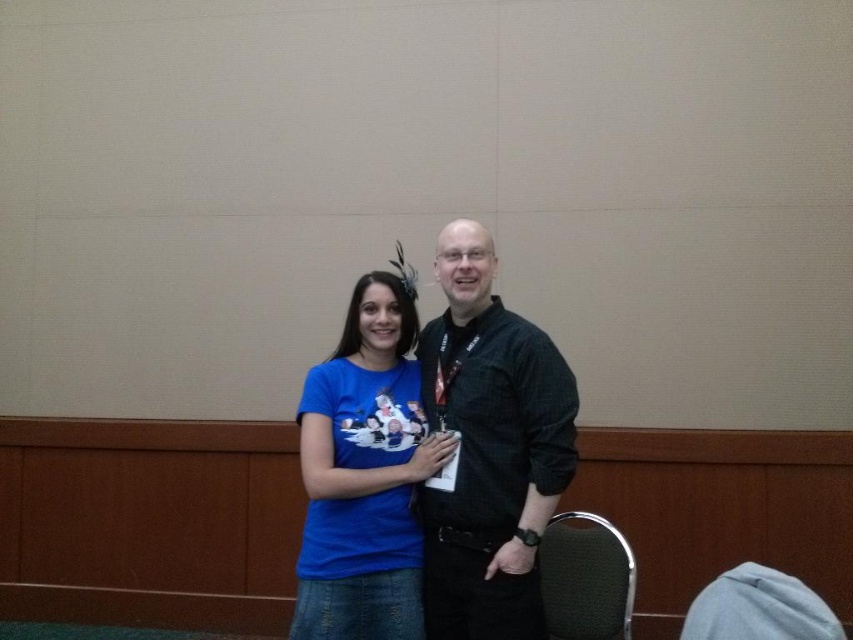
Question: Is black textured shirt at center below blue cotton t-shirt at center?

Choices:
 (A) yes
 (B) no

Answer: (B)

Question: Is blue cotton t-shirt at center closer to camera compared to green fabric chair at lower right?

Choices:
 (A) yes
 (B) no

Answer: (A)

Question: Can you confirm if blue cotton t-shirt at center is positioned to the left of green fabric chair at lower right?

Choices:
 (A) yes
 (B) no

Answer: (A)

Question: Which object is positioned closest to the black textured shirt at center?

Choices:
 (A) blue cotton t-shirt at center
 (B) green fabric chair at lower right

Answer: (A)

Question: Which point is farther from the camera taking this photo?

Choices:
 (A) (450, 227)
 (B) (328, 365)

Answer: (B)

Question: Which point is farther from the camera taking this photo?

Choices:
 (A) (552, 467)
 (B) (576, 536)
 (C) (355, 488)

Answer: (B)